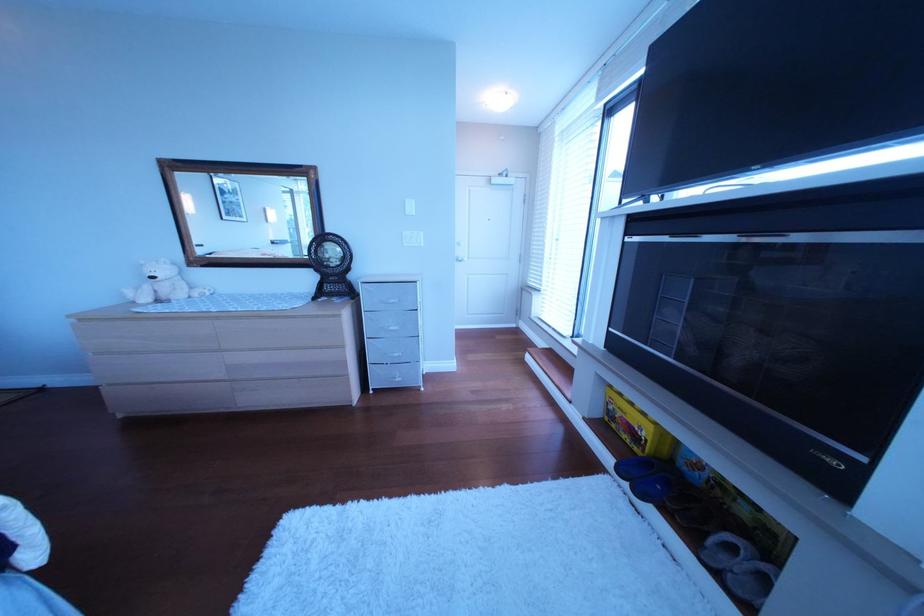
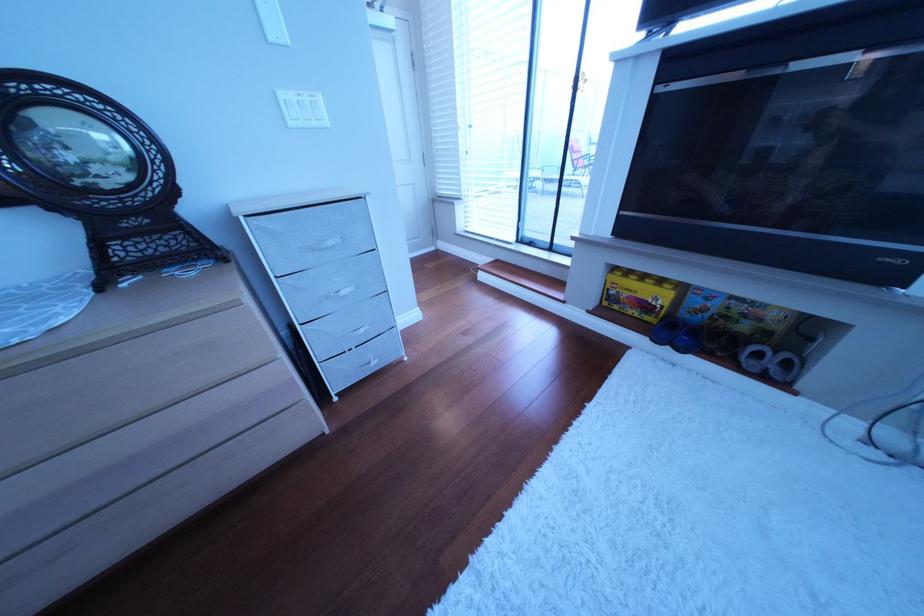
Find the pixel in the second image that matches [659,454] in the first image.

(672, 320)